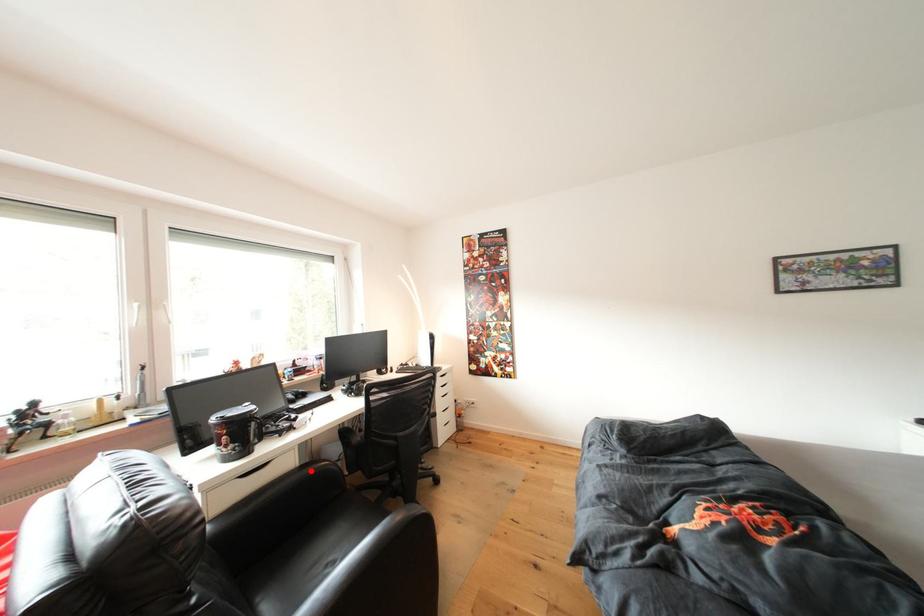
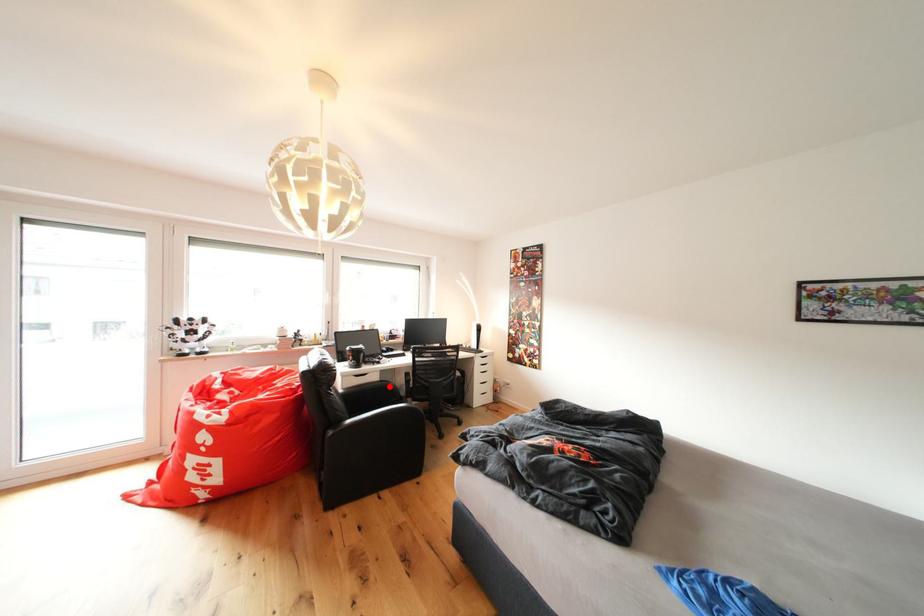
I am providing you with two images of the same scene from different viewpoints. A red point is marked on the first image and another point is marked on the second image. Are the points marked in image1 and image2 representing the same 3D position?

Yes